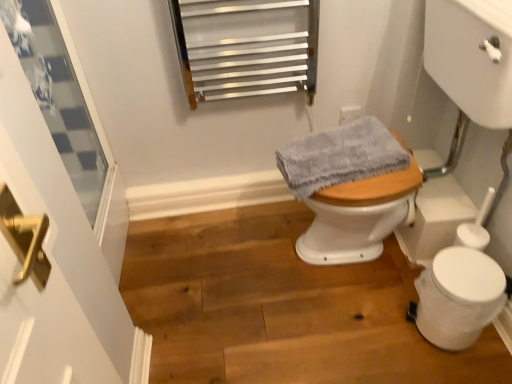
You are a GUI agent. You are given a task and a screenshot of the screen. Output one action in this format:
    pyautogui.click(x=<x>, y=<y>)
    Task: Click on the vacant area that is in front of white plastic toilet bowl at lower right
    Image resolution: width=512 pixels, height=384 pixels.
    Given the screenshot: What is the action you would take?
    pyautogui.click(x=462, y=368)